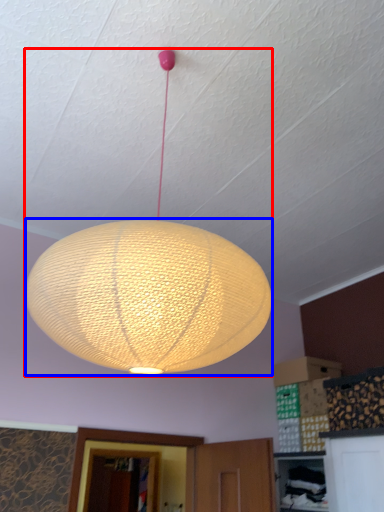
Question: Which point is closer to the camera, lamp (highlighted by a red box) or lantern (highlighted by a blue box)?

Choices:
 (A) lamp
 (B) lantern

Answer: (A)